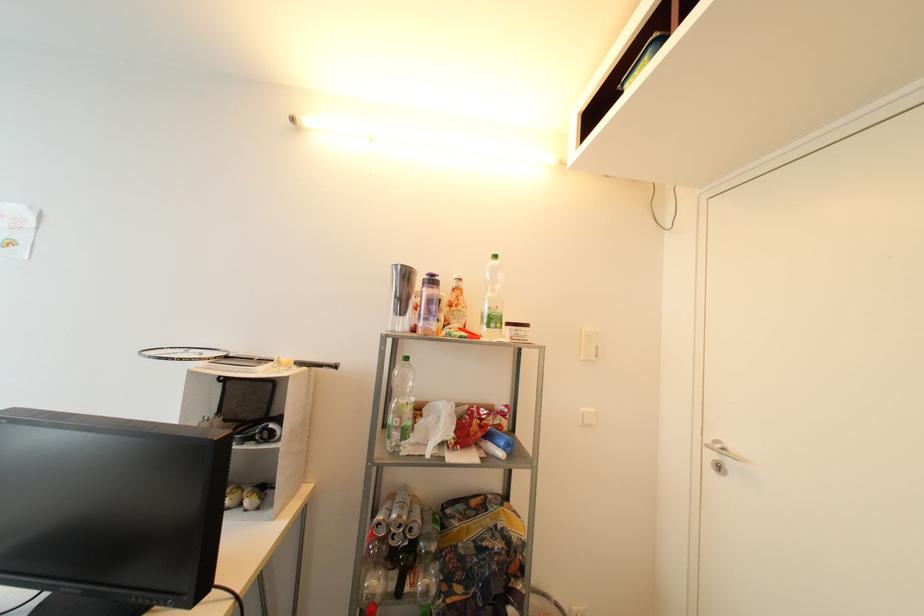
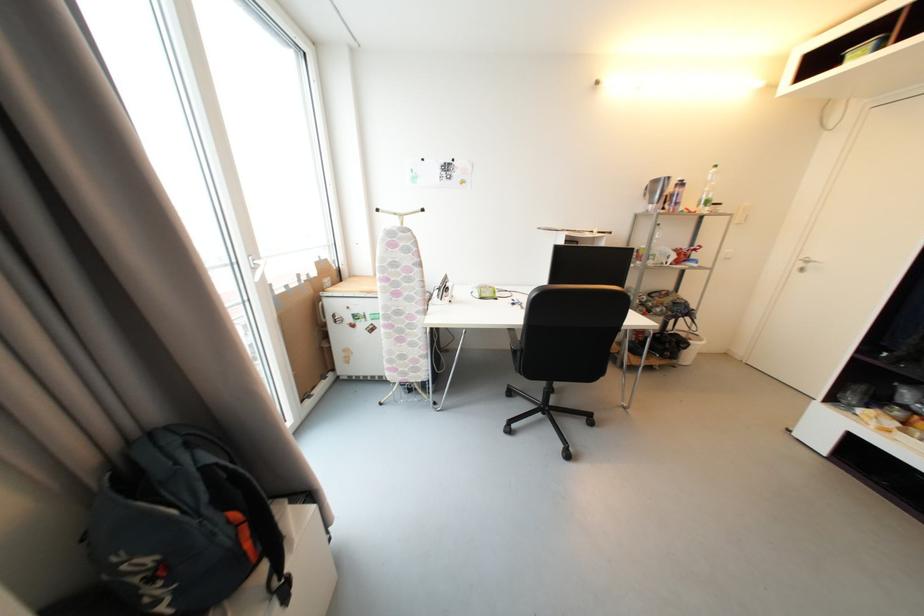
The images are taken continuously from a first-person perspective. In which direction are you moving?

The cameraman moved toward left, backward.